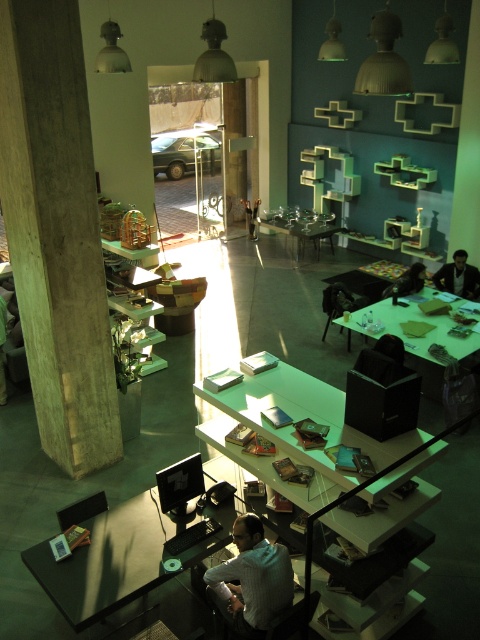
Question: Is concrete column at left closer to camera compared to dark brown leather jacket at right?

Choices:
 (A) yes
 (B) no

Answer: (A)

Question: Which point is farther to the camera?

Choices:
 (A) (25, 104)
 (B) (393, 292)

Answer: (B)

Question: Which of the following is the farthest from the observer?

Choices:
 (A) (78, 148)
 (B) (317, 384)
 (C) (311, 230)
 (D) (455, 307)

Answer: (C)

Question: Estimate the real-world distances between objects in this image. Which object is farther from the green matte table at center?

Choices:
 (A) black leather chair at upper right
 (B) white glossy table at center

Answer: (B)

Question: Does dark brown shirt at lower center appear over black leather chair at upper right?

Choices:
 (A) yes
 (B) no

Answer: (B)

Question: Does dark brown leather jacket at right appear over black leather chair at upper right?

Choices:
 (A) yes
 (B) no

Answer: (A)